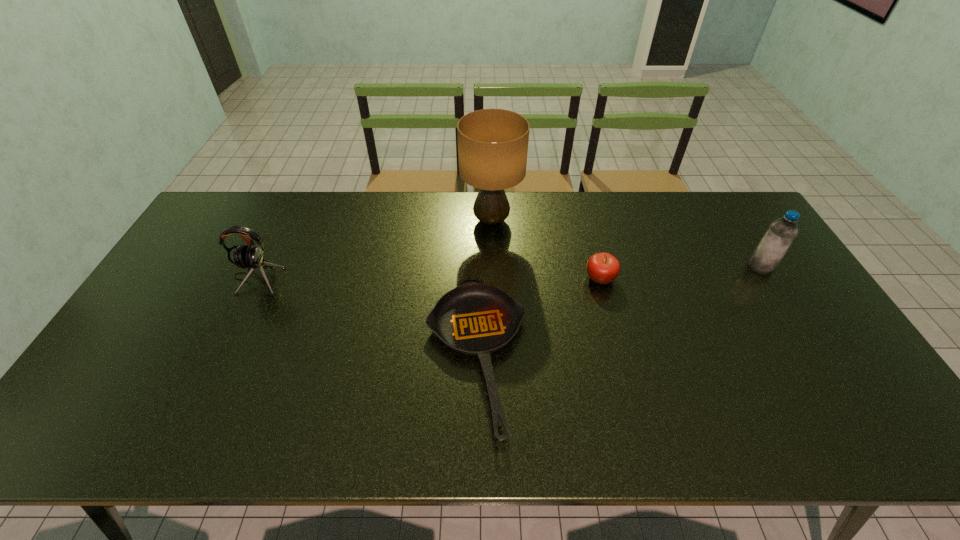
Find the location of a particular element. lampshade is located at coordinates (492, 143).

Identify the location of the tallest object. Image resolution: width=960 pixels, height=540 pixels. click(x=492, y=143).

You are a GUI agent. You are given a task and a screenshot of the screen. Output one action in this format:
    pyautogui.click(x=<x>, y=<y>)
    Task: Click on the rightmost object
    Image resolution: width=960 pixels, height=540 pixels.
    Given the screenshot: What is the action you would take?
    pyautogui.click(x=781, y=233)

The image size is (960, 540). In order to click on the leftmost object in this screenshot , I will do `click(251, 257)`.

The height and width of the screenshot is (540, 960). In order to click on apple in this screenshot , I will do `click(603, 268)`.

This screenshot has height=540, width=960. Find the location of `the fourth object from left to right`. the fourth object from left to right is located at coordinates (603, 268).

The image size is (960, 540). What are the coordinates of `frying pan` in the screenshot? It's located at (475, 319).

Where is `vacant space located on the front of the farthest object`? This screenshot has height=540, width=960. vacant space located on the front of the farthest object is located at coordinates (494, 335).

What are the coordinates of `free region located 0.080m on the left of the rightmost object` in the screenshot? It's located at (723, 267).

Where is `vacant space located 0.180m on the right of the leftmost object`? vacant space located 0.180m on the right of the leftmost object is located at coordinates (342, 277).